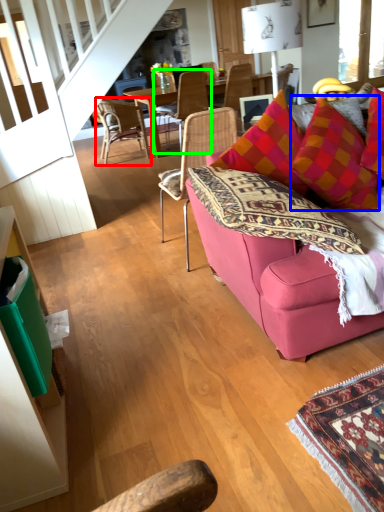
Question: Considering the real-world distances, which object is farthest from chair (highlighted by a red box)? throw pillow (highlighted by a blue box) or chair (highlighted by a green box)?

Choices:
 (A) throw pillow
 (B) chair

Answer: (A)